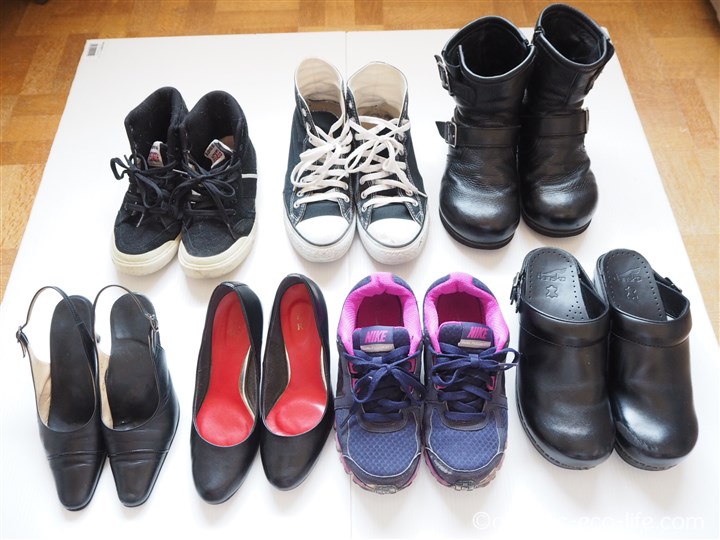
The width and height of the screenshot is (720, 540). I want to click on pairs of shoes, so click(98, 386), click(258, 393), click(422, 383), click(608, 376), click(518, 147), click(346, 176), click(181, 192).